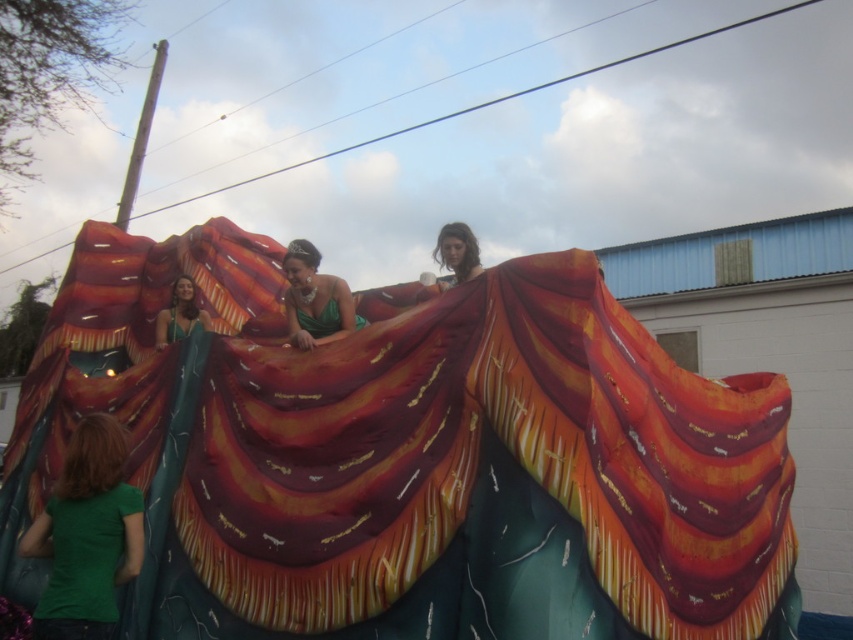
Is green matte shirt at lower left shorter than matte green fabric at upper center?

In fact, green matte shirt at lower left may be taller than matte green fabric at upper center.

Between point (74, 636) and point (434, 246), which one is positioned in front?

Point (74, 636)

This screenshot has height=640, width=853. Identify the location of green matte shirt at lower left. (86, 534).

Find the location of `shiny metallic blanket at center`. shiny metallic blanket at center is located at coordinates (409, 458).

Based on the photo, does shiny metallic blanket at center have a lesser width compared to green satin dress at center?

Indeed, shiny metallic blanket at center has a lesser width compared to green satin dress at center.

Between point (756, 541) and point (322, 292), which one is positioned behind?

The point (322, 292) is more distant.

The width and height of the screenshot is (853, 640). Identify the location of shiny metallic blanket at center. (409, 458).

Is shiny metallic blanket at center closer to camera compared to matte green fabric at upper center?

Yes, it is.

Who is positioned more to the right, shiny metallic blanket at center or matte green fabric at upper center?

shiny metallic blanket at center

Between point (143, 280) and point (462, 260), which one is positioned in front?

Point (462, 260) is in front.

Find the location of a particular element. Image resolution: width=853 pixels, height=640 pixels. shiny metallic blanket at center is located at coordinates (409, 458).